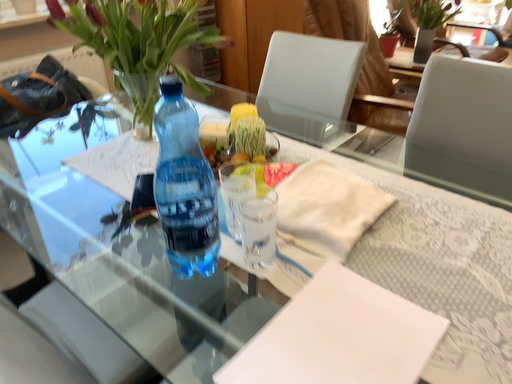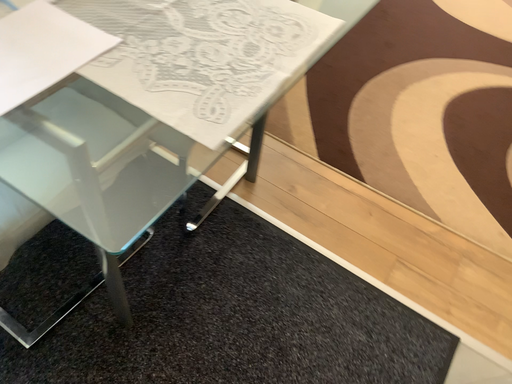
Question: How did the camera likely rotate when shooting the video?

Choices:
 (A) rotated right
 (B) rotated left

Answer: (A)